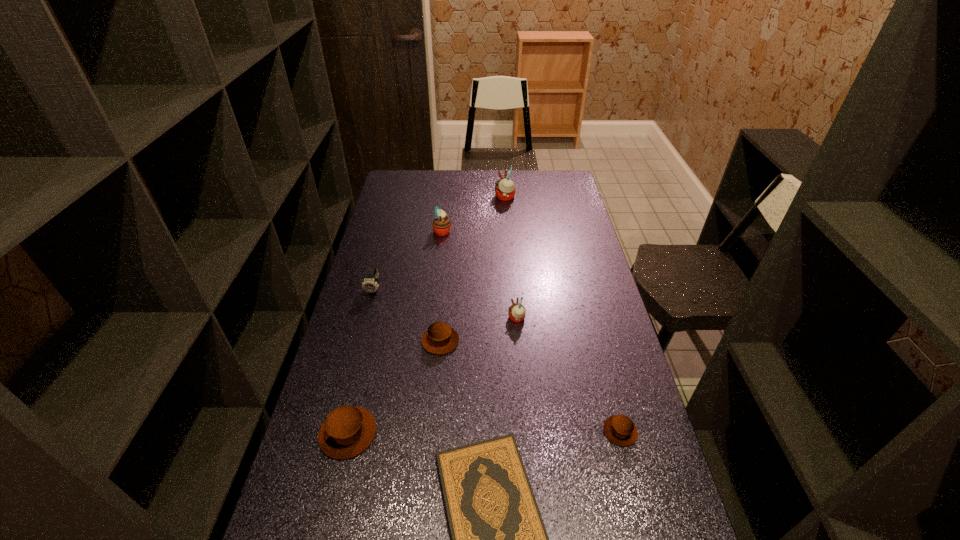
Locate an element on the screen. The height and width of the screenshot is (540, 960). brown muffin that stands as the closest to the leftmost brown muffin is located at coordinates (440, 338).

I want to click on free region that satisfies the following two spatial constraints: 1. on the front-facing side of the rightmost muffin; 2. on the right side of the second farthest pink muffin, so tap(420, 431).

Locate an element on the screen. The height and width of the screenshot is (540, 960). blank area in the image that satisfies the following two spatial constraints: 1. on the front-facing side of the seventh nearest object; 2. on the front side of the leftmost brown muffin is located at coordinates (420, 433).

Find the location of a particular element. This screenshot has width=960, height=540. free location that satisfies the following two spatial constraints: 1. on the back side of the fifth tallest muffin; 2. on the front-facing side of the seventh nearest object is located at coordinates (450, 231).